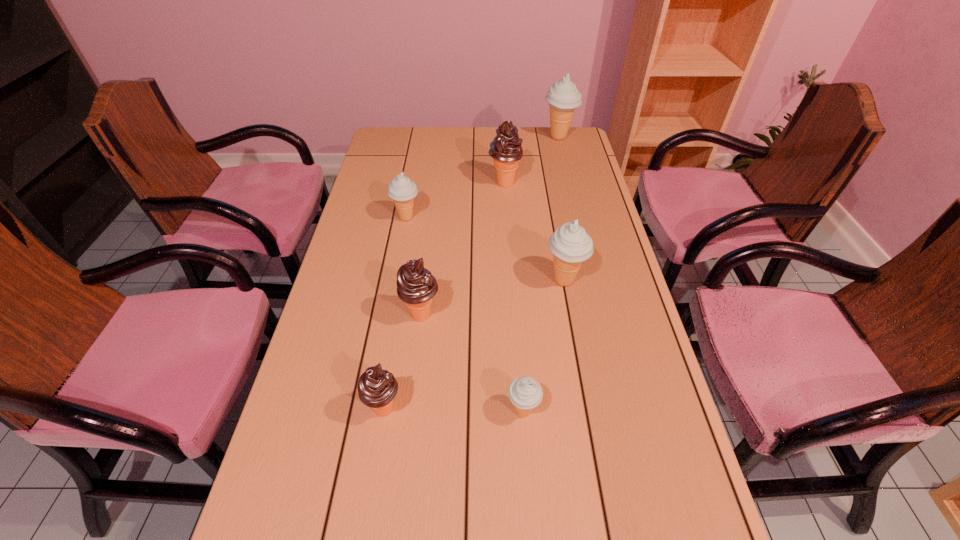
Locate an element on the screen. The height and width of the screenshot is (540, 960). the farthest object is located at coordinates (563, 97).

Find the location of `the farthest icecream`. the farthest icecream is located at coordinates (563, 97).

Find the location of a particular element. Image resolution: width=960 pixels, height=540 pixels. the rightmost chocolate icecream is located at coordinates (506, 150).

The image size is (960, 540). In order to click on the sixth nearest icecream in this screenshot , I will do `click(506, 150)`.

Identify the location of the third nearest object. coord(416,286).

The height and width of the screenshot is (540, 960). In order to click on the fifth farthest icecream in this screenshot , I will do `click(416, 286)`.

This screenshot has height=540, width=960. I want to click on the fourth nearest icecream, so click(570, 245).

Find the location of `the third smallest beige icecream`. the third smallest beige icecream is located at coordinates (570, 245).

This screenshot has width=960, height=540. I want to click on the nearest chocolate icecream, so click(x=377, y=388).

Where is `the leftmost beige icecream`? The width and height of the screenshot is (960, 540). the leftmost beige icecream is located at coordinates (401, 189).